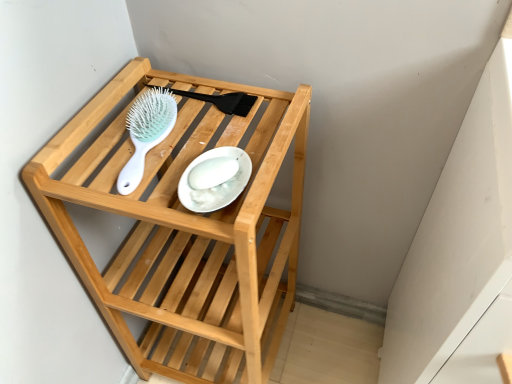
What are the coordinates of `free space in front of light blue plastic hairbrush at upper center` in the screenshot? It's located at (152, 199).